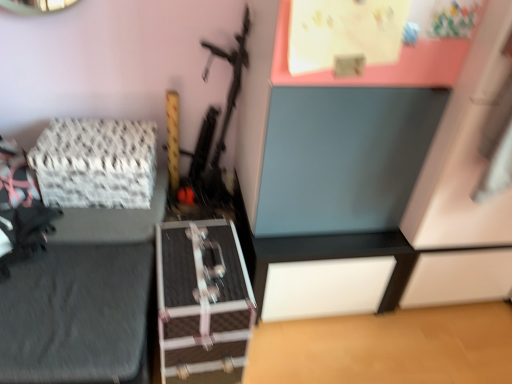
Question: Considering the positions of matte blue drawer at upper center and white woven fabric at left in the image, is matte blue drawer at upper center taller or shorter than white woven fabric at left?

Choices:
 (A) short
 (B) tall

Answer: (B)

Question: Considering their positions, is matte blue drawer at upper center located in front of or behind white woven fabric at left?

Choices:
 (A) behind
 (B) front

Answer: (B)

Question: Looking at the image, does matte blue drawer at upper center seem bigger or smaller compared to white woven fabric at left?

Choices:
 (A) small
 (B) big

Answer: (B)

Question: From the image's perspective, relative to matte blue drawer at upper center, is white woven fabric at left above or below?

Choices:
 (A) below
 (B) above

Answer: (A)

Question: Is white woven fabric at left inside the boundaries of matte blue drawer at upper center, or outside?

Choices:
 (A) outside
 (B) inside

Answer: (A)

Question: Considering the positions of point (140, 182) and point (476, 261), is point (140, 182) closer or farther from the camera than point (476, 261)?

Choices:
 (A) closer
 (B) farther

Answer: (A)

Question: In terms of width, does white woven fabric at left look wider or thinner when compared to matte blue drawer at upper center?

Choices:
 (A) thin
 (B) wide

Answer: (A)